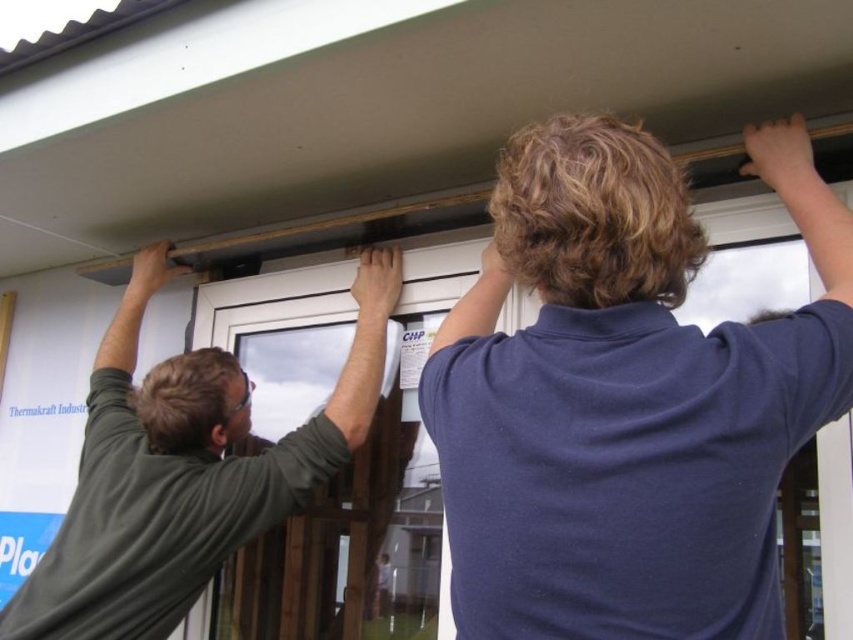
In the scene shown: Measure the distance from dark blue shirt at upper center to dark green shirt at upper left.

A distance of 34.07 inches exists between dark blue shirt at upper center and dark green shirt at upper left.

Does dark blue shirt at upper center have a larger size compared to dark green shirt at upper left?

Incorrect, dark blue shirt at upper center is not larger than dark green shirt at upper left.

Which is in front, point (550, 413) or point (61, 560)?

Point (550, 413)

You are a GUI agent. You are given a task and a screenshot of the screen. Output one action in this format:
    pyautogui.click(x=<x>, y=<y>)
    Task: Click on the dark blue shirt at upper center
    This screenshot has width=853, height=640.
    Given the screenshot: What is the action you would take?
    pyautogui.click(x=625, y=397)